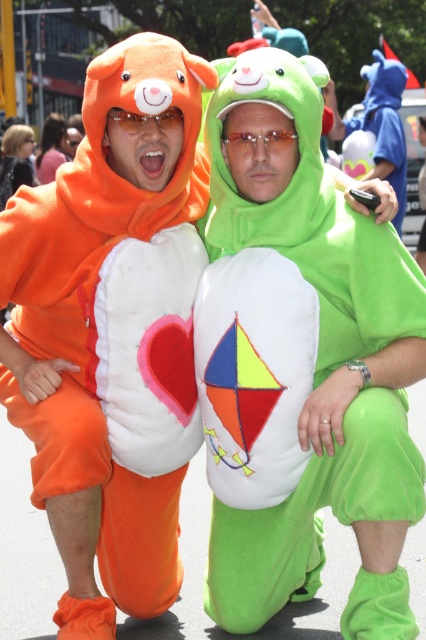
Does transparent plastic goggles at center appear on the right side of matte plastic goggles at upper center?

Yes, transparent plastic goggles at center is to the right of matte plastic goggles at upper center.

At what (x,y) coordinates should I click in order to perform the action: click on transparent plastic goggles at center. Please return your answer as a coordinate pair (x, y). The image size is (426, 640). Looking at the image, I should click on (258, 141).

Identify the location of transparent plastic goggles at center. This screenshot has height=640, width=426. (258, 141).

At what (x,y) coordinates should I click in order to perform the action: click on transparent plastic goggles at center. Please return your answer as a coordinate pair (x, y). Looking at the image, I should click on (258, 141).